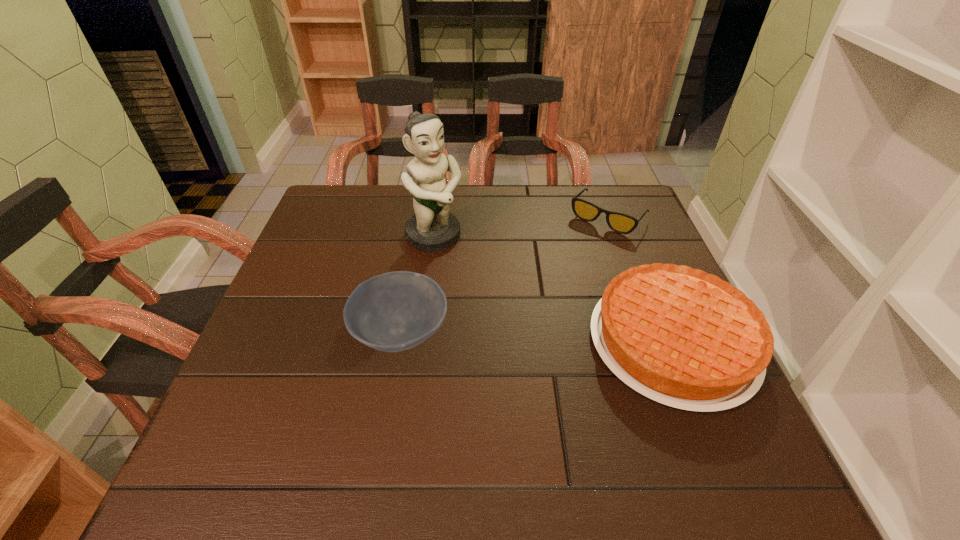
The image size is (960, 540). Find the location of `free spot between the pie and the figurine`. free spot between the pie and the figurine is located at coordinates (553, 289).

Find the location of a particular element. free point between the sunglasses and the tallest object is located at coordinates (521, 227).

At what (x,y) coordinates should I click in order to perform the action: click on object that is the third nearest to the shortest object. Please return your answer as a coordinate pair (x, y). Looking at the image, I should click on (395, 311).

Identify which object is the third nearest to the sunglasses. Please provide its 2D coordinates. Your answer should be formatted as a tuple, i.e. [(x, y)], where the tuple contains the x and y coordinates of a point satisfying the conditions above.

[(395, 311)]

In order to click on free region that satisfies the following two spatial constraints: 1. on the front side of the pie; 2. on the right side of the bowl in this screenshot , I will do `click(399, 342)`.

The height and width of the screenshot is (540, 960). In order to click on vacant space that satisfies the following two spatial constraints: 1. on the front side of the pie; 2. on the right side of the bowl in this screenshot , I will do `click(399, 342)`.